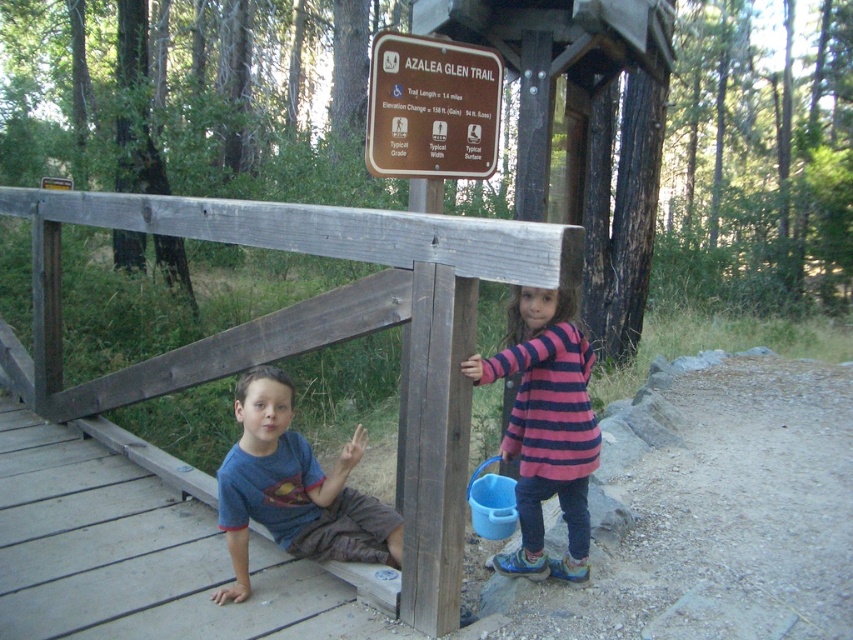
You are a parent trying to take a photo of your children on the bridge. You want to ensure both the pink striped sweater at center and the brown wooden sign at upper center are clearly visible in the frame. Which object should you focus on first to make sure both are in focus?

The pink striped sweater at center is taller than the brown wooden sign at upper center. To ensure both are in focus, focus on the pink striped sweater at center first, as it is larger and more prominent in the scene.

You are a hiker trying to read the brown wooden sign at upper center on the bridge. There is a pink striped sweater at center in your way. Is the sign above or below the sweater?

The brown wooden sign at upper center is above the pink striped sweater at center because the pink striped sweater at center is below the brown wooden sign at upper center.

Based on the photo, you are a parent trying to locate your child who is wearing a blue cotton shirt at lower left. You are standing near the brown wooden sign at upper center. Can you see your child from your current position?

The distance between the blue cotton shirt at lower left and the brown wooden sign at upper center is 1.03 meters, so yes, you can see your child from your current position as the distance is short.